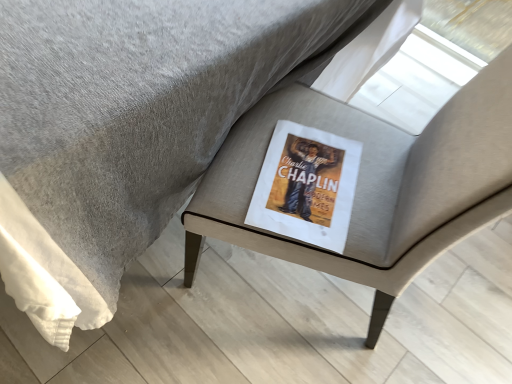
At what (x,y) coordinates should I click in order to perform the action: click on free space above matte paper book at center (from a real-world perspective). Please return your answer as a coordinate pair (x, y). This screenshot has width=512, height=384. Looking at the image, I should click on (309, 181).